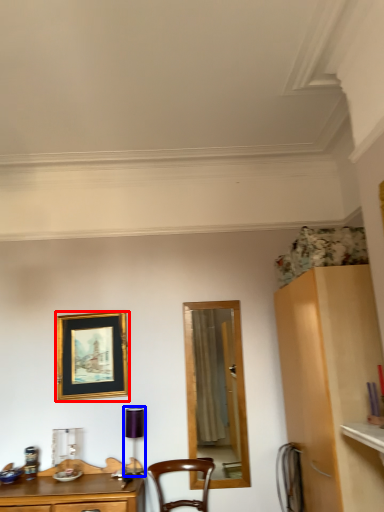
Question: Which object appears closest to the camera in this image, picture frame (highlighted by a red box) or lamp (highlighted by a blue box)?

Choices:
 (A) picture frame
 (B) lamp

Answer: (B)